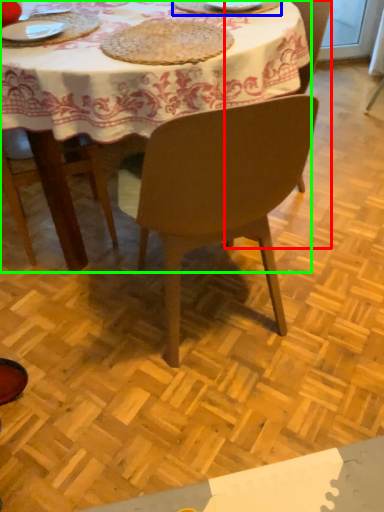
Question: Which object is positioned farthest from chair (highlighted by a red box)? Select from tableware (highlighted by a blue box) and kitchen & dining room table (highlighted by a green box).

Choices:
 (A) tableware
 (B) kitchen & dining room table

Answer: (B)